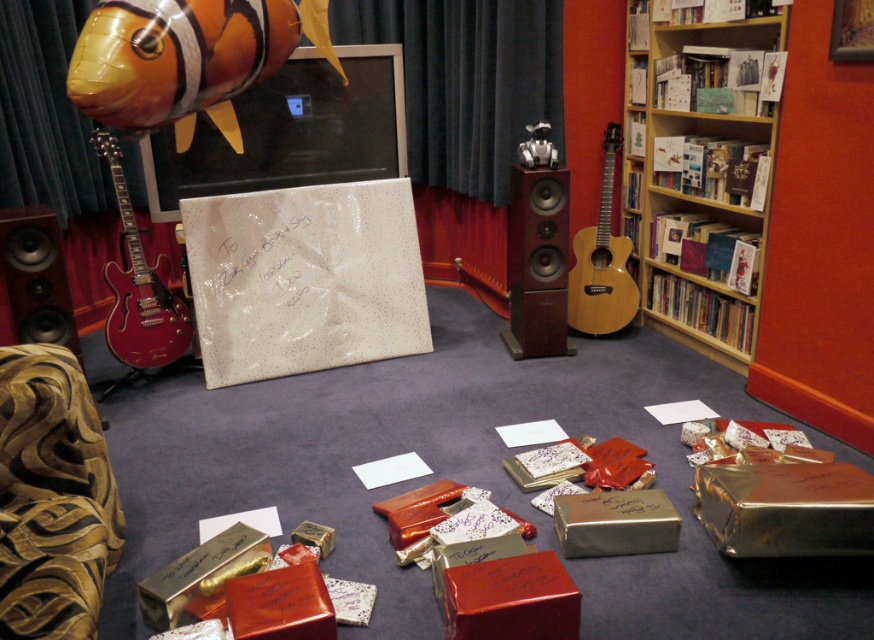
Question: Is gold metallic box at lower right below metallic gold box at center?

Choices:
 (A) yes
 (B) no

Answer: (B)

Question: Among these points, which one is nearest to the camera?

Choices:
 (A) (196, 214)
 (B) (171, 83)

Answer: (B)

Question: Does wooden/matte speaker at center appear under natural wood acoustic guitar at center-right?

Choices:
 (A) no
 (B) yes

Answer: (B)

Question: Which point appears closest to the camera in this image?

Choices:
 (A) click(114, 280)
 (B) click(503, 636)
 (C) click(656, 177)
 (D) click(52, 273)

Answer: (B)

Question: Which point appears farthest from the camera in this image?

Choices:
 (A) (160, 104)
 (B) (538, 157)
 (C) (512, 572)
 (D) (810, 554)

Answer: (B)

Question: Can you confirm if glossy white board at center is bigger than metallic gold gift box at center?

Choices:
 (A) no
 (B) yes

Answer: (B)